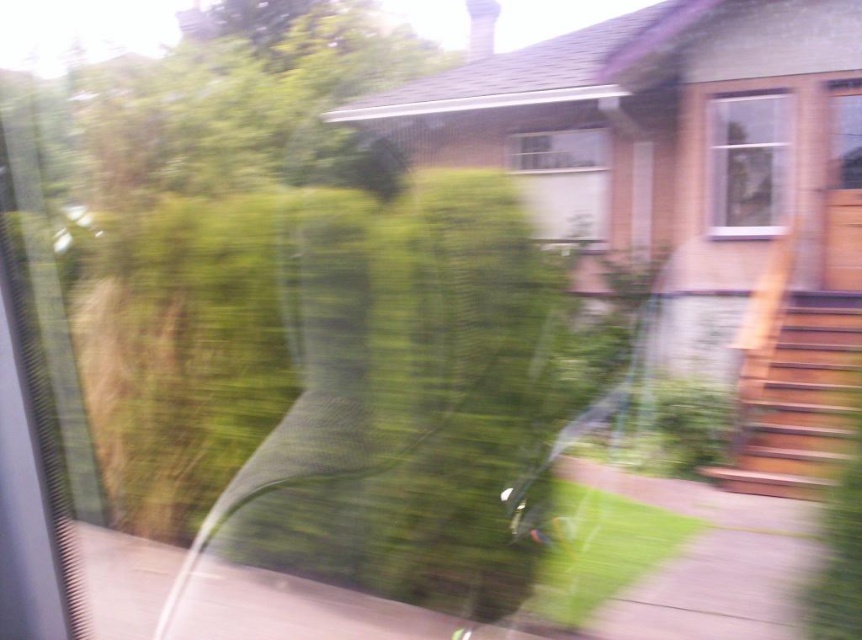
Question: Can you confirm if white glass window at upper right is positioned above transparent plastic screen door at upper right?

Choices:
 (A) no
 (B) yes

Answer: (B)

Question: Which object is farther from the camera taking this photo?

Choices:
 (A) clear glass window at center
 (B) transparent plastic screen door at upper right
 (C) white glass window at upper right

Answer: (A)

Question: Which is farther from the white glass window at upper right?

Choices:
 (A) clear glass window at center
 (B) transparent plastic screen door at upper right

Answer: (A)

Question: Which point appears closest to the camera in this image?

Choices:
 (A) (826, 282)
 (B) (566, 140)
 (C) (782, 200)

Answer: (A)

Question: Where is white glass window at upper right located in relation to clear glass window at center in the image?

Choices:
 (A) left
 (B) right

Answer: (B)

Question: Does white glass window at upper right appear on the right side of clear glass window at center?

Choices:
 (A) yes
 (B) no

Answer: (A)